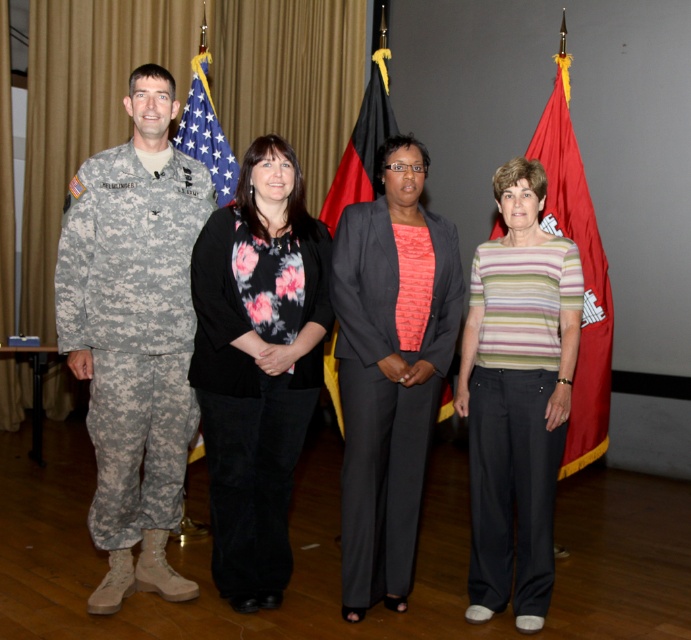
Is red fabric flag at right further to camera compared to american flag at left?

No, red fabric flag at right is closer to the viewer.

Based on the photo, who is higher up, red fabric flag at right or american flag at left?

american flag at left is higher up.

The width and height of the screenshot is (691, 640). In order to click on red fabric flag at right in this screenshot , I will do `click(583, 273)`.

Which is more to the left, black fabric flag at center or american flag at left?

american flag at left

Which is behind, point (375, 67) or point (218, 125)?

Point (375, 67)

The height and width of the screenshot is (640, 691). What are the coordinates of `black fabric flag at center` in the screenshot? It's located at (x=361, y=147).

Based on the photo, is camouflage fabric uniform at left shorter than black matte floral blouse at center?

Incorrect, camouflage fabric uniform at left's height does not fall short of black matte floral blouse at center's.

Between camouflage fabric uniform at left and black matte floral blouse at center, which one has more height?

camouflage fabric uniform at left

Locate an element on the screen. camouflage fabric uniform at left is located at coordinates (133, 328).